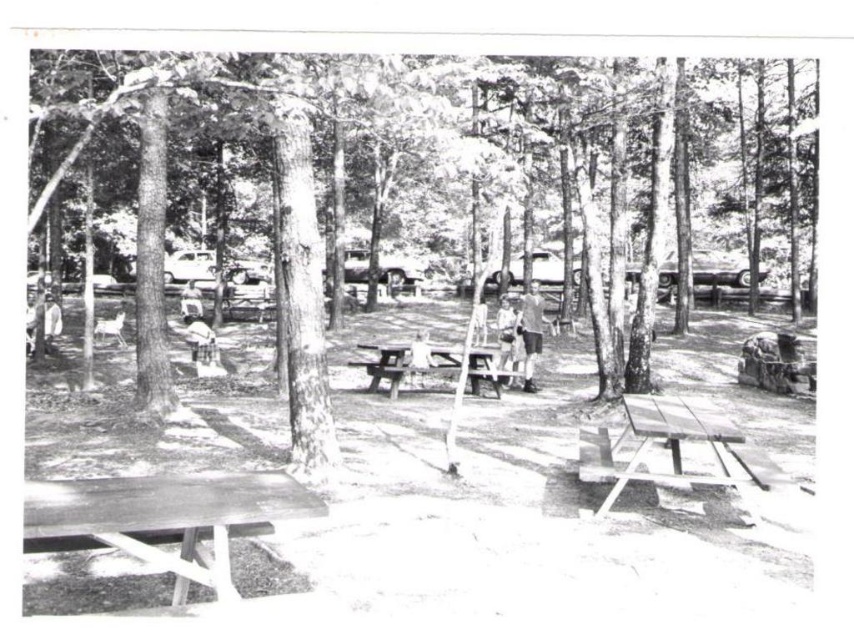
Question: Which is nearer to the wooden picnic table at lower right?

Choices:
 (A) smooth bark tree at center
 (B) smooth wood table at lower left
 (C) wooden picnic table at center

Answer: (B)

Question: Where is smooth bark tree at center located in relation to wooden picnic table at lower right in the image?

Choices:
 (A) above
 (B) below

Answer: (A)

Question: In this image, where is smooth bark tree at center located relative to smooth wooden bench at center?

Choices:
 (A) below
 (B) above

Answer: (B)

Question: Does smooth bark tree at center appear on the right side of smooth wooden bench at center?

Choices:
 (A) yes
 (B) no

Answer: (A)

Question: Which point is closer to the camera taking this photo?

Choices:
 (A) (452, 104)
 (B) (674, 452)
 (C) (196, 307)
 (D) (92, 509)

Answer: (D)

Question: Estimate the real-world distances between objects in this image. Which object is closer to the smooth white shirt at center?

Choices:
 (A) smooth wood table at lower left
 (B) wooden picnic table at center
 (C) wooden picnic table at lower right
 (D) light brown fabric shirt at center

Answer: (D)